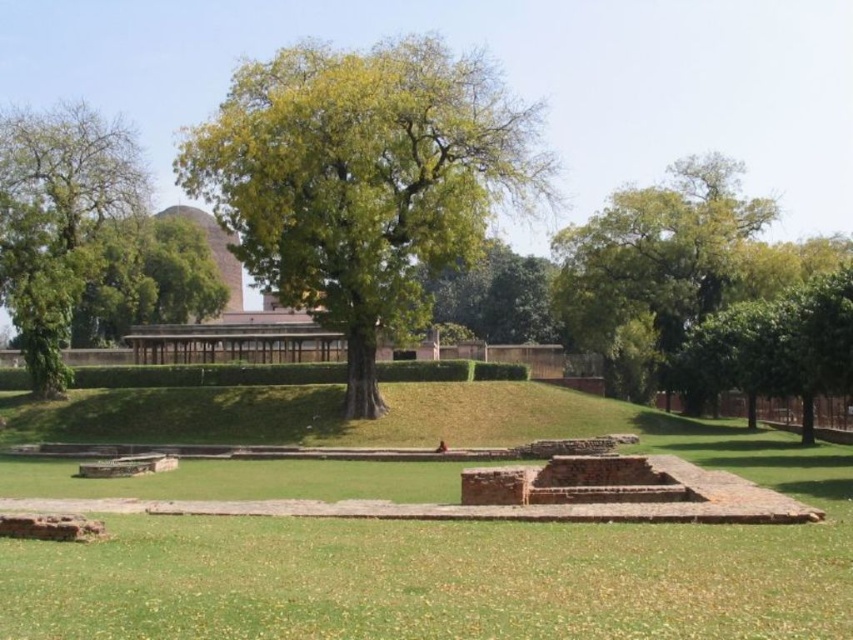
Question: Can you confirm if green grass at center is positioned above green leafy tree at upper right?

Choices:
 (A) no
 (B) yes

Answer: (A)

Question: Which point appears closest to the camera in this image?

Choices:
 (A) (374, 300)
 (B) (271, 428)
 (C) (700, 308)

Answer: (A)

Question: Which point is farther to the camera?

Choices:
 (A) green leafy tree at upper right
 (B) green leafy tree at center

Answer: (A)

Question: Among these objects, which one is nearest to the camera?

Choices:
 (A) green leafy tree at center
 (B) green leafy tree at left
 (C) green grass at center

Answer: (C)

Question: Does green leafy tree at upper right come behind green leafy tree at left?

Choices:
 (A) no
 (B) yes

Answer: (B)

Question: Considering the relative positions of green leafy tree at upper right and green leafy tree at left in the image provided, where is green leafy tree at upper right located with respect to green leafy tree at left?

Choices:
 (A) below
 (B) above

Answer: (A)